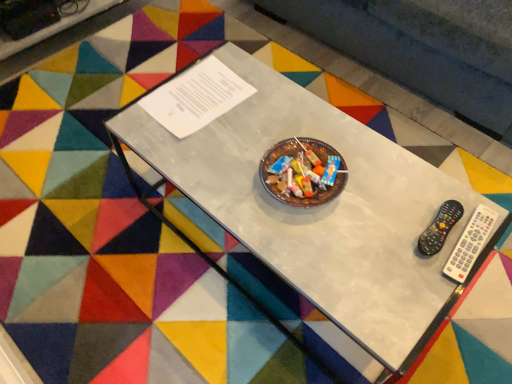
What are the coordinates of `vacant position to the left of white plastic remote at right` in the screenshot? It's located at (385, 246).